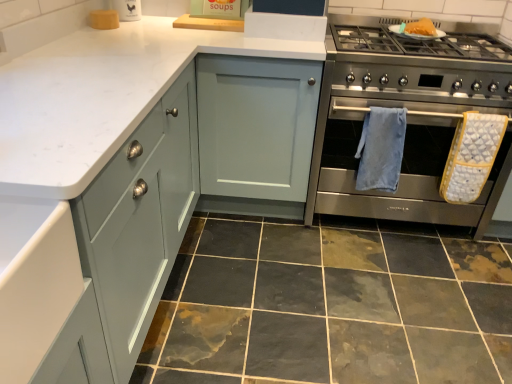
Question: Can you confirm if white marble countertop at upper left is taller than blue soft towel at center right, the 2th bath towel positioned from the right?

Choices:
 (A) yes
 (B) no

Answer: (A)

Question: Would you say white marble countertop at upper left is a long distance from blue soft towel at center right, the 2th bath towel positioned from the right?

Choices:
 (A) no
 (B) yes

Answer: (A)

Question: From the image's perspective, does white marble countertop at upper left appear higher than blue soft towel at center right, arranged as the 1th bath towel when viewed from the left?

Choices:
 (A) no
 (B) yes

Answer: (B)

Question: Would you say white marble countertop at upper left is outside blue soft towel at center right, the 2th bath towel positioned from the right?

Choices:
 (A) no
 (B) yes

Answer: (B)

Question: Does white marble countertop at upper left appear on the left side of blue soft towel at center right, arranged as the 1th bath towel when viewed from the left?

Choices:
 (A) no
 (B) yes

Answer: (B)

Question: Does white marble countertop at upper left have a lesser width compared to blue soft towel at center right, arranged as the 1th bath towel when viewed from the left?

Choices:
 (A) yes
 (B) no

Answer: (B)

Question: Does stainless steel oven at right have a larger size compared to yellow textured oven mitt at right, positioned as the first bath towel in right-to-left order?

Choices:
 (A) yes
 (B) no

Answer: (A)

Question: From the image's perspective, is stainless steel oven at right located above yellow textured oven mitt at right, positioned as the first bath towel in right-to-left order?

Choices:
 (A) no
 (B) yes

Answer: (B)

Question: Could you tell me if stainless steel oven at right is turned towards yellow textured oven mitt at right, placed as the 2th bath towel when sorted from left to right?

Choices:
 (A) yes
 (B) no

Answer: (A)

Question: Is stainless steel oven at right outside yellow textured oven mitt at right, positioned as the first bath towel in right-to-left order?

Choices:
 (A) yes
 (B) no

Answer: (A)

Question: Can you confirm if stainless steel oven at right is shorter than yellow textured oven mitt at right, positioned as the first bath towel in right-to-left order?

Choices:
 (A) no
 (B) yes

Answer: (A)

Question: From a real-world perspective, is stainless steel oven at right located higher than yellow textured oven mitt at right, placed as the 2th bath towel when sorted from left to right?

Choices:
 (A) yes
 (B) no

Answer: (A)

Question: Would you say white marble countertop at upper left is outside yellow textured oven mitt at right, placed as the 2th bath towel when sorted from left to right?

Choices:
 (A) no
 (B) yes

Answer: (B)